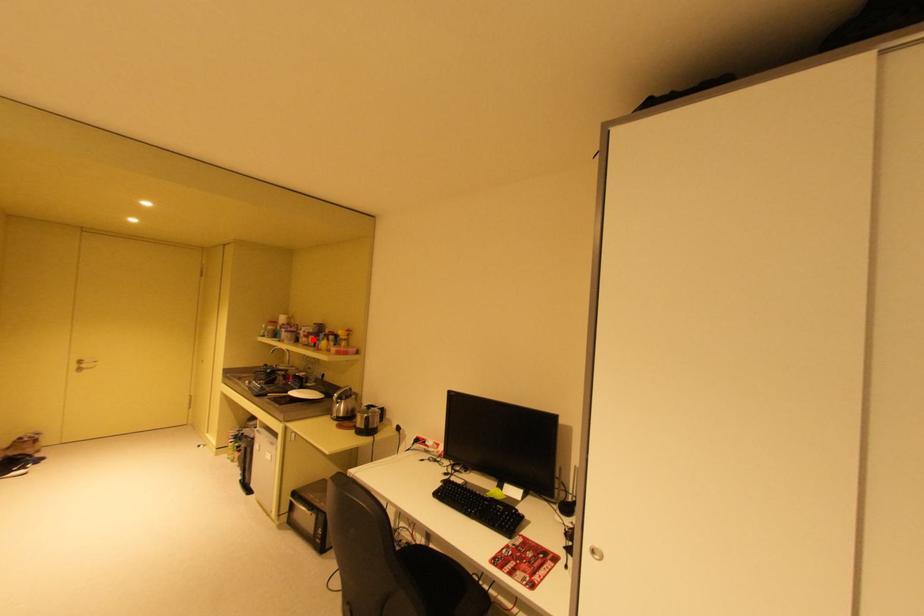
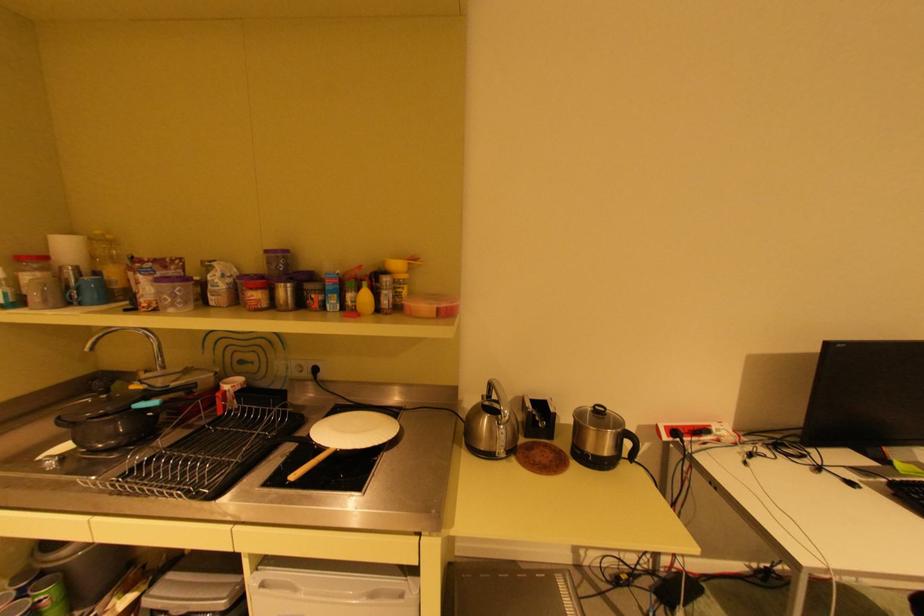
Where in the second image is the point corresponding to the highlighted location from the first image?

(264, 294)